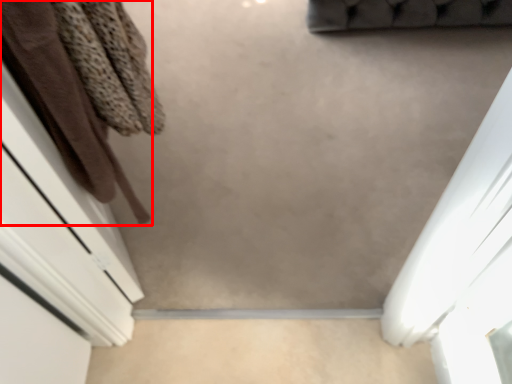
Question: From the image's perspective, considering the relative positions of clothing (annotated by the red box) and concrete in the image provided, where is clothing (annotated by the red box) located with respect to the staircase?

Choices:
 (A) above
 (B) below

Answer: (A)